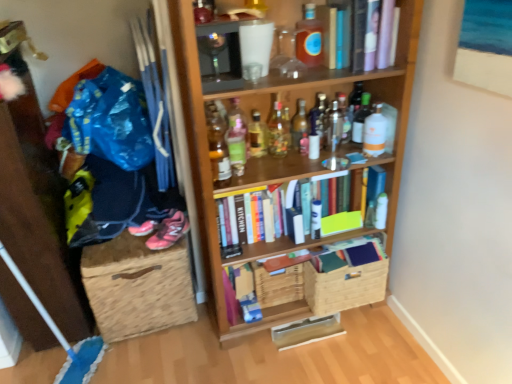
Question: Which direction should I rotate to look at translucent plastic bottle at upper center, marked as the 2th bottle in a right-to-left arrangement, — up or down?

Choices:
 (A) down
 (B) up

Answer: (B)

Question: Which direction should I rotate to face translucent glass bottle at center, arranged as the seventh bottle when viewed from the right, — up or down?

Choices:
 (A) up
 (B) down

Answer: (A)

Question: Considering the relative sizes of burlap storage box at lower left and translucent glass bottle at center, which is the 11th bottle from right to left, in the image provided, is burlap storage box at lower left taller than translucent glass bottle at center, which is the 11th bottle from right to left,?

Choices:
 (A) no
 (B) yes

Answer: (B)

Question: Does burlap storage box at lower left come behind translucent glass bottle at center, which ranks as the first bottle in left-to-right order?

Choices:
 (A) yes
 (B) no

Answer: (A)

Question: Is burlap storage box at lower left oriented towards translucent glass bottle at center, which ranks as the first bottle in left-to-right order?

Choices:
 (A) yes
 (B) no

Answer: (B)

Question: Considering the relative sizes of burlap storage box at lower left and translucent glass bottle at center, which ranks as the first bottle in left-to-right order, in the image provided, is burlap storage box at lower left shorter than translucent glass bottle at center, which ranks as the first bottle in left-to-right order,?

Choices:
 (A) yes
 (B) no

Answer: (B)

Question: Can you confirm if burlap storage box at lower left is thinner than translucent glass bottle at center, which ranks as the first bottle in left-to-right order?

Choices:
 (A) no
 (B) yes

Answer: (A)

Question: From a real-world perspective, is burlap storage box at lower left located higher than translucent glass bottle at center, which ranks as the first bottle in left-to-right order?

Choices:
 (A) yes
 (B) no

Answer: (B)

Question: From the image's perspective, does translucent plastic bottle at center, the 2th bottle in the left-to-right sequence, appear lower than translucent glass bottle at center, which is the 11th bottle from right to left?

Choices:
 (A) yes
 (B) no

Answer: (B)

Question: Does translucent plastic bottle at center, the 10th bottle from the right, turn towards translucent glass bottle at center, which is the 11th bottle from right to left?

Choices:
 (A) yes
 (B) no

Answer: (B)

Question: Considering the relative positions of translucent plastic bottle at center, the 10th bottle from the right, and translucent glass bottle at center, which is the 11th bottle from right to left, in the image provided, is translucent plastic bottle at center, the 10th bottle from the right, behind translucent glass bottle at center, which is the 11th bottle from right to left,?

Choices:
 (A) yes
 (B) no

Answer: (A)

Question: Can you confirm if translucent plastic bottle at center, the 10th bottle from the right, is thinner than translucent glass bottle at center, which ranks as the first bottle in left-to-right order?

Choices:
 (A) no
 (B) yes

Answer: (A)

Question: Is translucent plastic bottle at center, the 10th bottle from the right, not close to translucent glass bottle at center, which ranks as the first bottle in left-to-right order?

Choices:
 (A) yes
 (B) no

Answer: (B)

Question: Considering the relative positions of translucent plastic bottle at center, the 10th bottle from the right, and translucent glass bottle at center, which is the 11th bottle from right to left, in the image provided, is translucent plastic bottle at center, the 10th bottle from the right, to the left of translucent glass bottle at center, which is the 11th bottle from right to left, from the viewer's perspective?

Choices:
 (A) no
 (B) yes

Answer: (A)

Question: Can you confirm if translucent glass bottle at upper center, which is the eleventh bottle from left to right, is bigger than blue fabric pants at left?

Choices:
 (A) yes
 (B) no

Answer: (B)